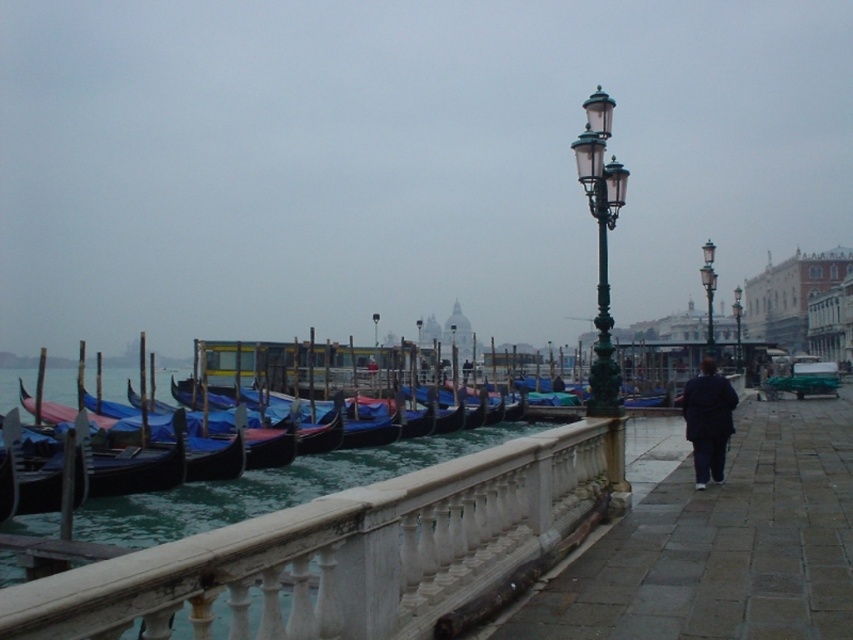
Question: Estimate the real-world distances between objects in this image. Which object is closer to the green metal streetlamp at center?

Choices:
 (A) green metal streetlight at center
 (B) green metal/glass streetlamp at center-right
 (C) white marble railing at center

Answer: (A)

Question: Does white marble railing at center appear on the left side of dark gray stone pavement at center-right?

Choices:
 (A) yes
 (B) no

Answer: (A)

Question: Which of these objects is positioned closest to the white marble railing at center?

Choices:
 (A) green metal/glass streetlamp at center-right
 (B) dark gray stone pavement at center-right
 (C) green metal streetlight at center
 (D) green glass streetlight at center

Answer: (B)

Question: Does white marble railing at center have a lesser width compared to green metal/glass streetlamp at center-right?

Choices:
 (A) no
 (B) yes

Answer: (B)

Question: Is dark blue fabric pants at lower right to the right of green metal streetlamp at center from the viewer's perspective?

Choices:
 (A) yes
 (B) no

Answer: (A)

Question: Which object is positioned farthest from the green glass streetlight at center?

Choices:
 (A) dark blue fabric pants at lower right
 (B) green metal/glass streetlamp at center-right
 (C) green metal streetlight at center

Answer: (A)